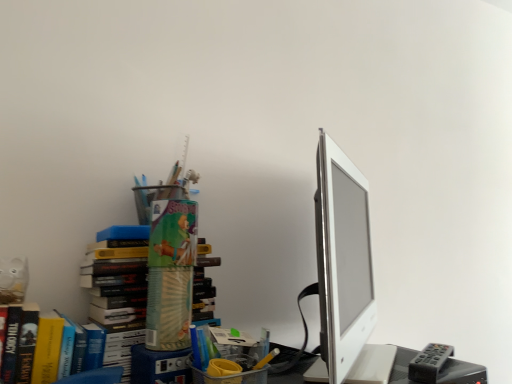
Question: In the image, is gray plastic remote at lower right on the left side or the right side of smooth plastic desk at lower right?

Choices:
 (A) right
 (B) left

Answer: (A)

Question: Considering the positions of gray plastic remote at lower right and smooth plastic desk at lower right in the image, is gray plastic remote at lower right bigger or smaller than smooth plastic desk at lower right?

Choices:
 (A) small
 (B) big

Answer: (A)

Question: Which is farther from the gray plastic remote at lower right?

Choices:
 (A) smooth plastic desk at lower right
 (B) white glossy computer monitor at right

Answer: (B)

Question: Estimate the real-world distances between objects in this image. Which object is farther from the smooth plastic desk at lower right?

Choices:
 (A) white glossy computer monitor at right
 (B) gray plastic remote at lower right

Answer: (A)